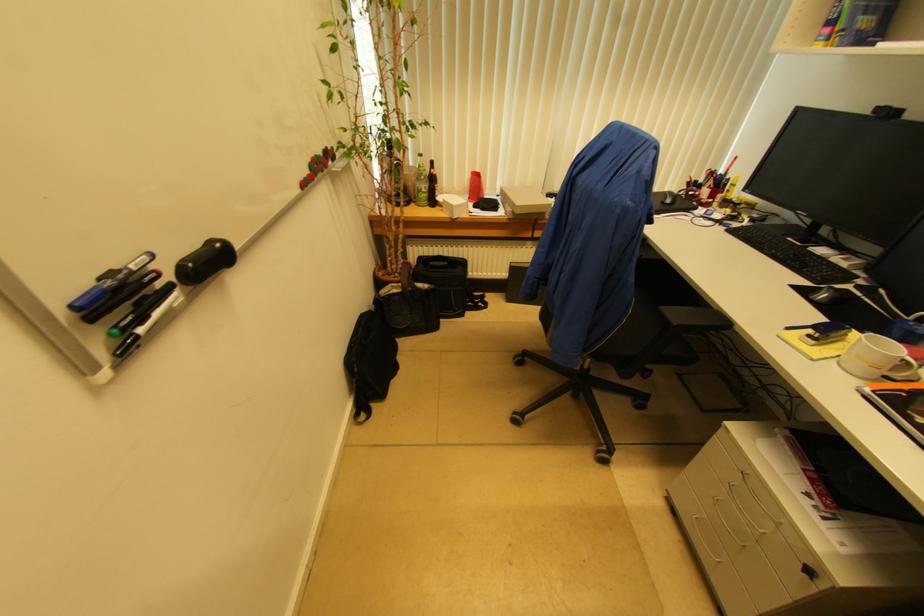
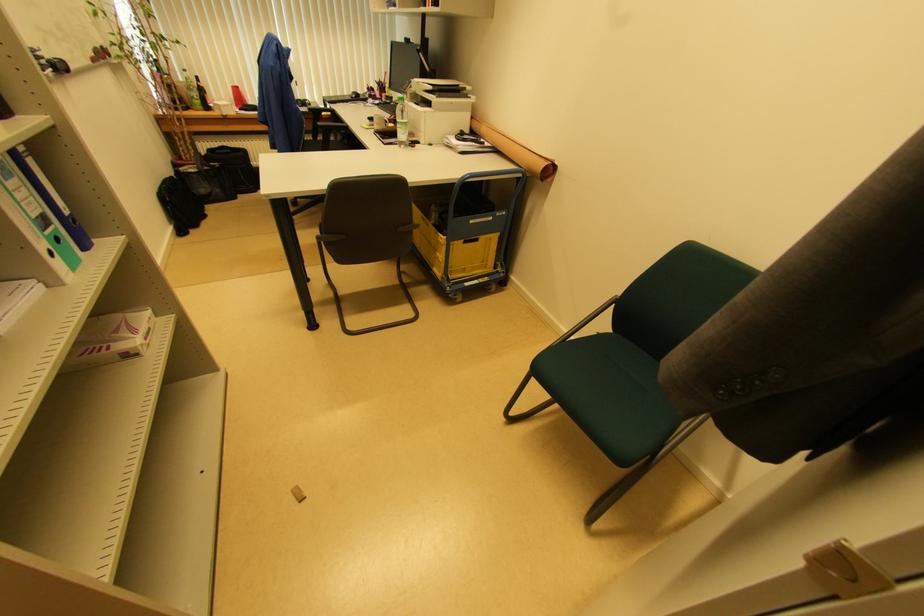
Question: I am providing you with two images of the same scene from different viewpoints. Which of the following objects are not visible in image2?

Choices:
 (A) blue cart handle
 (B) yellow plastic crate
 (C) green glass bottle
 (D) none of these

Answer: (D)